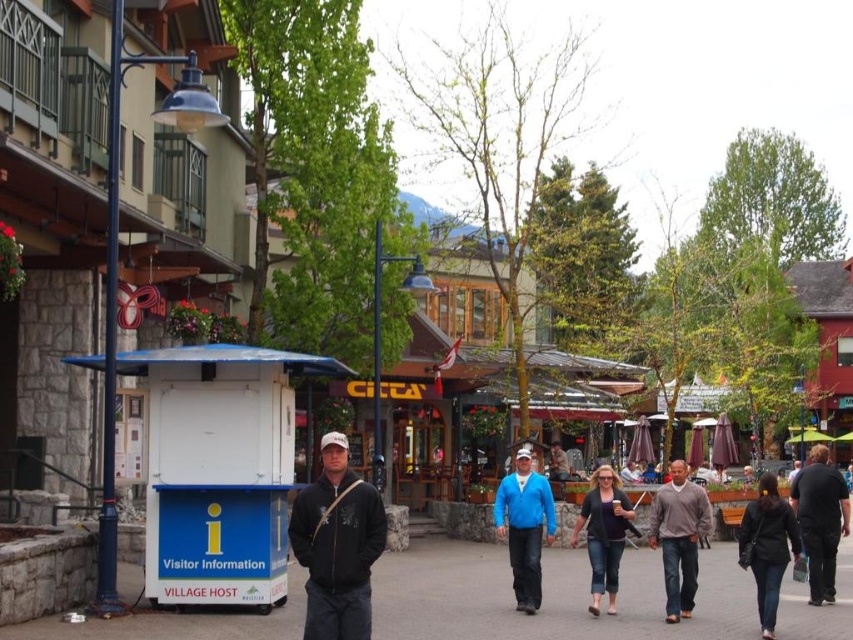
Is the position of brown sweater at center more distant than that of black matte jacket at lower right?

No, it is not.

Which is behind, point (680, 499) or point (801, 476)?

Point (801, 476)

In order to click on brown sweater at center in this screenshot , I will do `click(679, 538)`.

From the picture: Is dark gray asphalt at center behind dark gray hoodie at center?

Yes, it is behind dark gray hoodie at center.

Which is below, dark gray asphalt at center or dark gray hoodie at center?

dark gray asphalt at center is below.

Is point (375, 602) positioned after point (364, 509)?

Yes, it is.

This screenshot has width=853, height=640. I want to click on dark gray asphalt at center, so click(x=549, y=596).

In the scene shown: Between brown sweater at center and denim pants at center, which one is positioned lower?

Positioned lower is denim pants at center.

Which of these two, brown sweater at center or denim pants at center, stands taller?

brown sweater at center is taller.

Is point (682, 611) closer to viewer compared to point (624, 500)?

Yes, it is.

This screenshot has height=640, width=853. What are the coordinates of `brown sweater at center` in the screenshot? It's located at (679, 538).